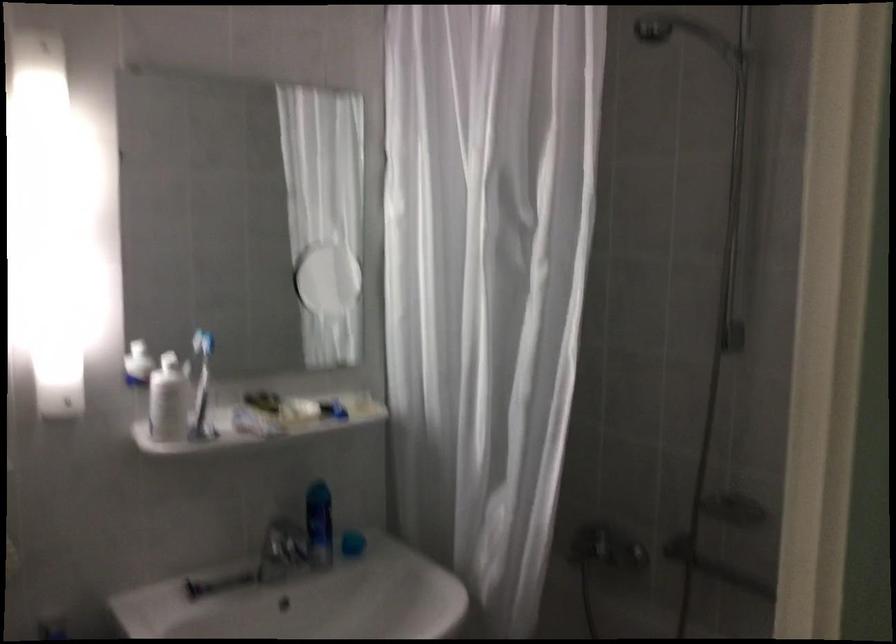
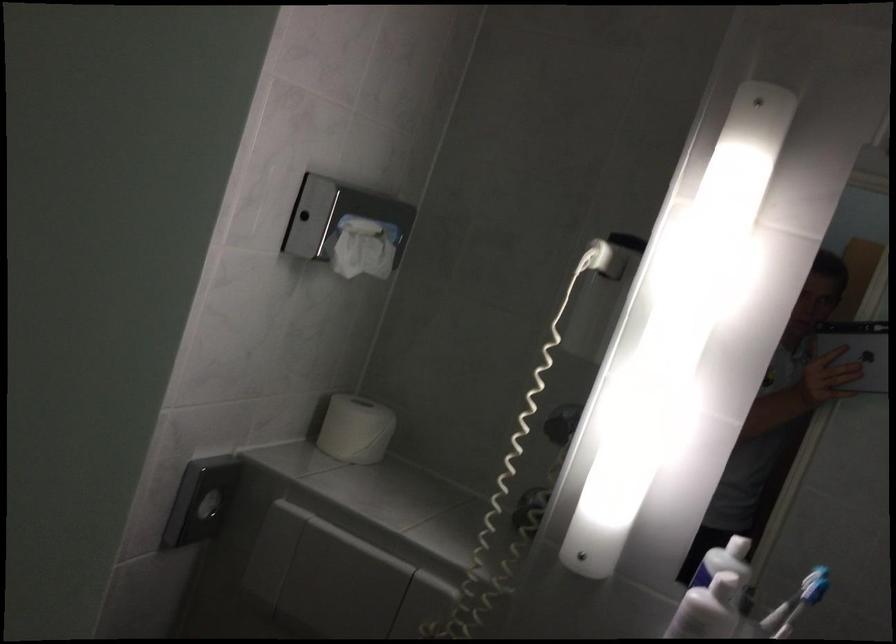
Question: Based on the continuous images, in which direction is the camera rotating? Reply with the corresponding letter.

Choices:
 (A) Left
 (B) Right
 (C) Up
 (D) Down

Answer: (A)